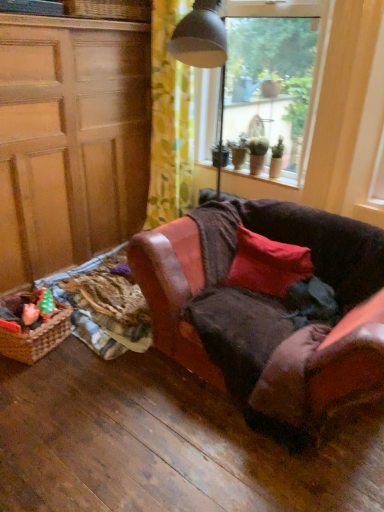
Question: Relative to woven brown picnic basket at lower left, is woven wicker basket at upper left in front or behind?

Choices:
 (A) front
 (B) behind

Answer: (B)

Question: Is woven wicker basket at upper left spatially inside woven brown picnic basket at lower left, or outside of it?

Choices:
 (A) outside
 (B) inside

Answer: (A)

Question: Which is nearer to the matte red pillow at center?

Choices:
 (A) transparent glass window at upper center
 (B) smooth wooden window sill at upper center
 (C) green matte plant at upper right, acting as the 1th houseplant starting from the left
 (D) leather couch at center
 (E) woven wicker basket at upper left

Answer: (D)

Question: Based on their relative distances, which object is nearer to the matte wood cabinet at left?

Choices:
 (A) leather couch at center
 (B) plush pink toy at lower left
 (C) green matte houseplant at upper right, acting as the 2th houseplant starting from the left
 (D) woven brown picnic basket at lower left
 (E) green matte plant at upper right, acting as the 1th houseplant starting from the left

Answer: (D)